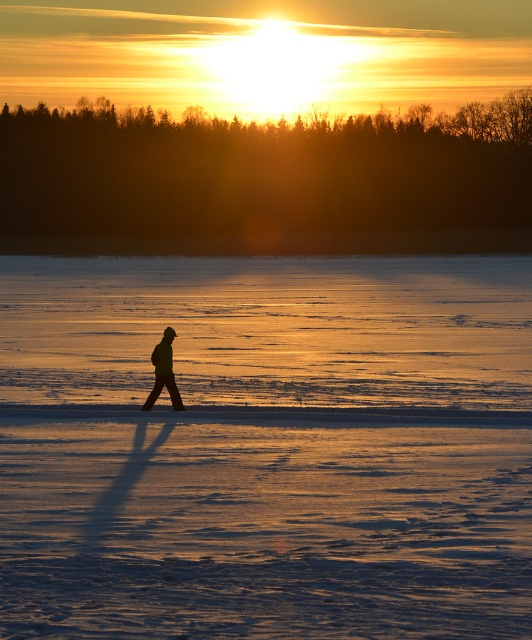
Is smooth ice at center thinner than silhouette jacket at center?

In fact, smooth ice at center might be wider than silhouette jacket at center.

Who is shorter, smooth ice at center or silhouette jacket at center?

Standing shorter between the two is silhouette jacket at center.

Image resolution: width=532 pixels, height=640 pixels. I want to click on smooth ice at center, so click(267, 448).

At what (x,y) coordinates should I click in order to perform the action: click on smooth ice at center. Please return your answer as a coordinate pair (x, y). This screenshot has height=640, width=532. Looking at the image, I should click on (267, 448).